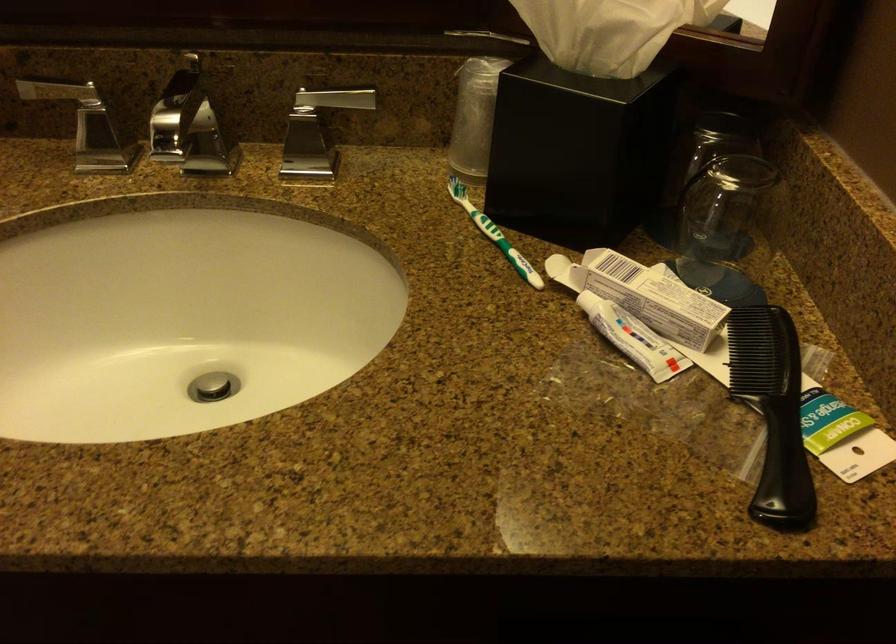
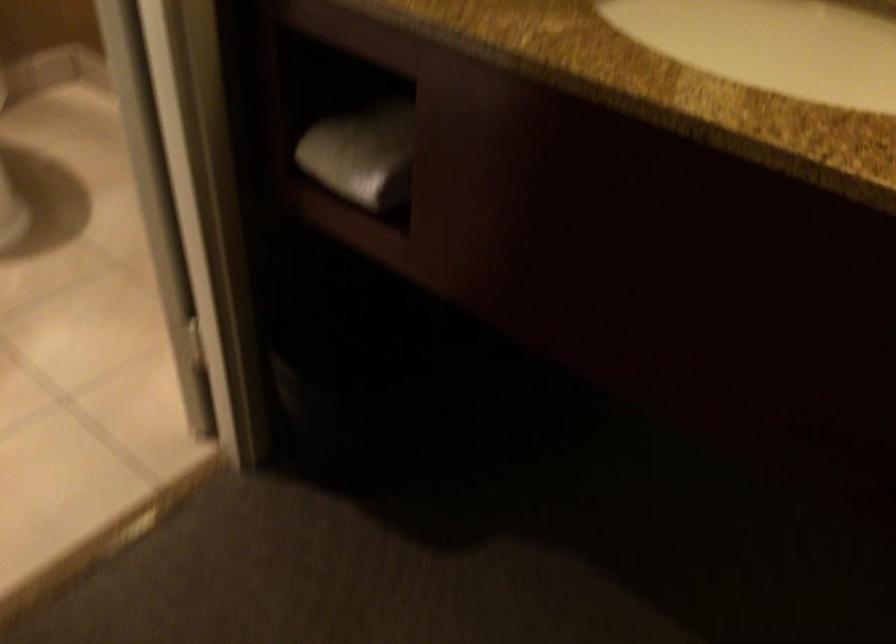
Question: The camera is either moving clockwise (left) or counter-clockwise (right) around the object. The first image is from the beginning of the video and the second image is from the end. Is the camera moving left or right when shooting the video?

Choices:
 (A) Left
 (B) Right

Answer: (B)